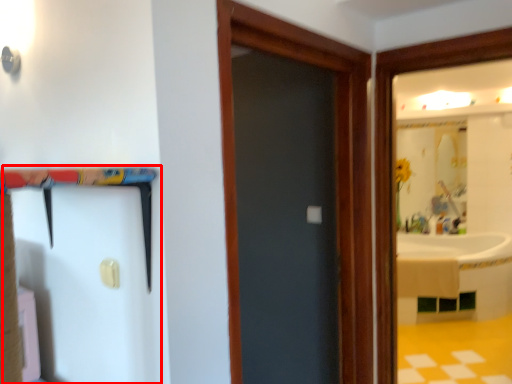
Question: Where is barn door (annotated by the red box) located in relation to door in the image?

Choices:
 (A) left
 (B) right

Answer: (A)